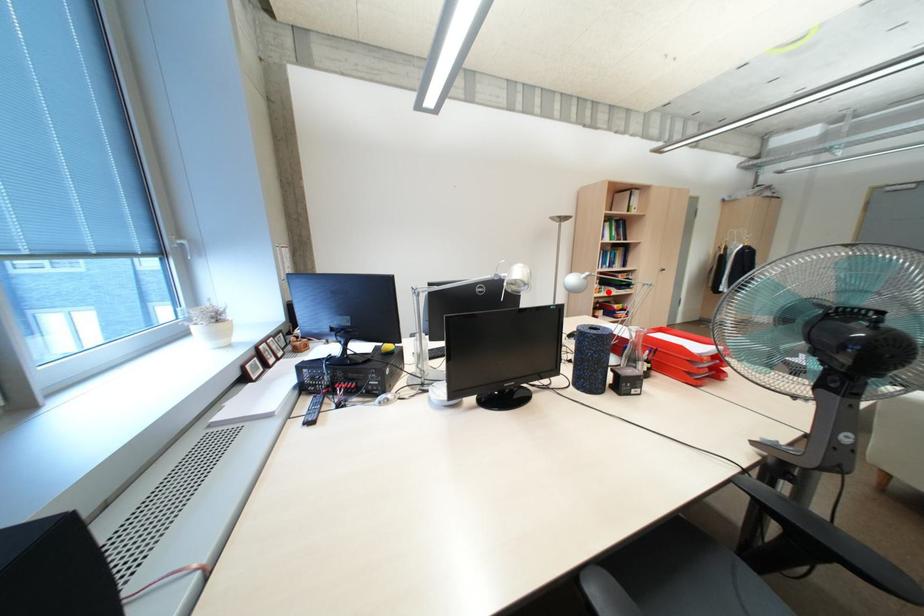
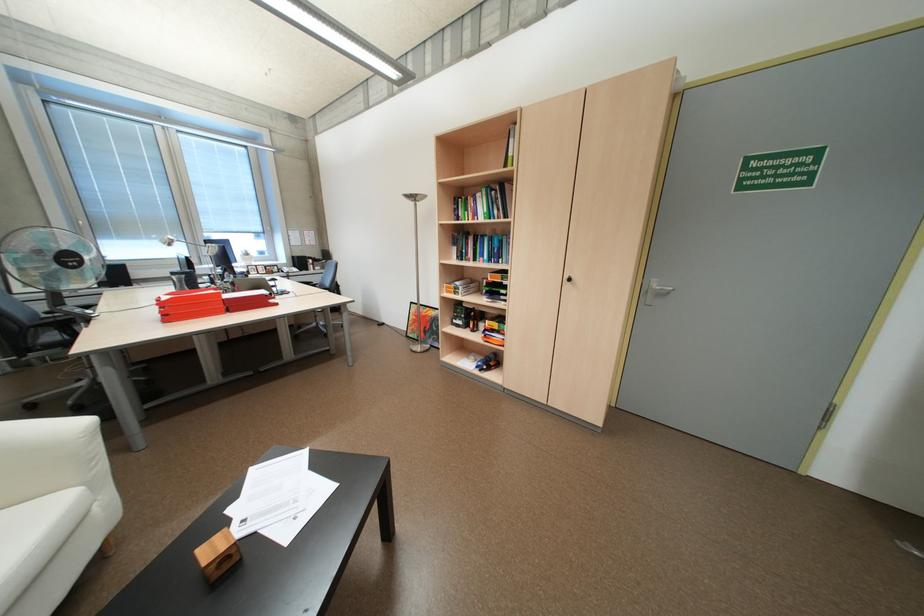
Where in the second image is the point corresponding to the highlighted location from the first image?

(465, 293)